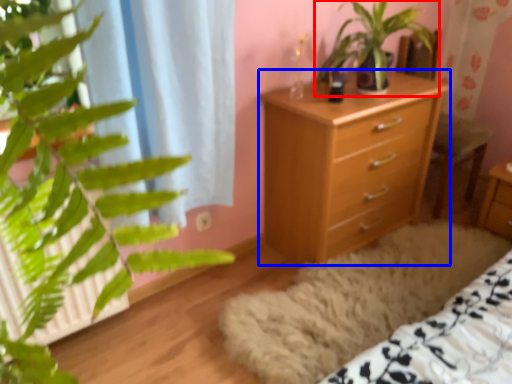
Question: Which point is closer to the camera, houseplant (highlighted by a red box) or chest of drawers (highlighted by a blue box)?

Choices:
 (A) houseplant
 (B) chest of drawers

Answer: (A)